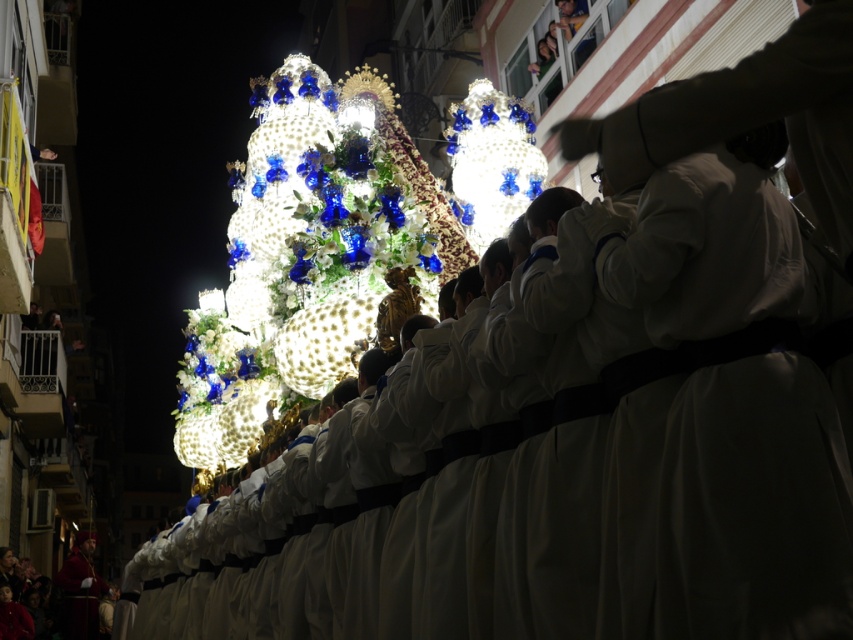
In the scene shown: You are a photographer trying to capture the white matte robe at center in the nighttime scene. Based on its position, where should you aim your camera to ensure it is centered in your shot?

To center the white matte robe at center in your shot, aim your camera at the coordinates point (735, 408) as that is the 2D location of the white matte robe at center.

You are part of the procession and need to decide which item to carry. The white matte robe at center and the iridescent glass ornament at center are both available. Which one can you hold more easily due to its size?

The white matte robe at center is thinner than the iridescent glass ornament at center, so it can be held more easily due to its smaller size.

You are standing in the crowd watching the nighttime procession. There are two points marked in the image. One is at coordinates point [474,221] and the other is at point [94,532]. Which point is nearer to you?

Point [474,221] is closer to the viewer than point [94,532].